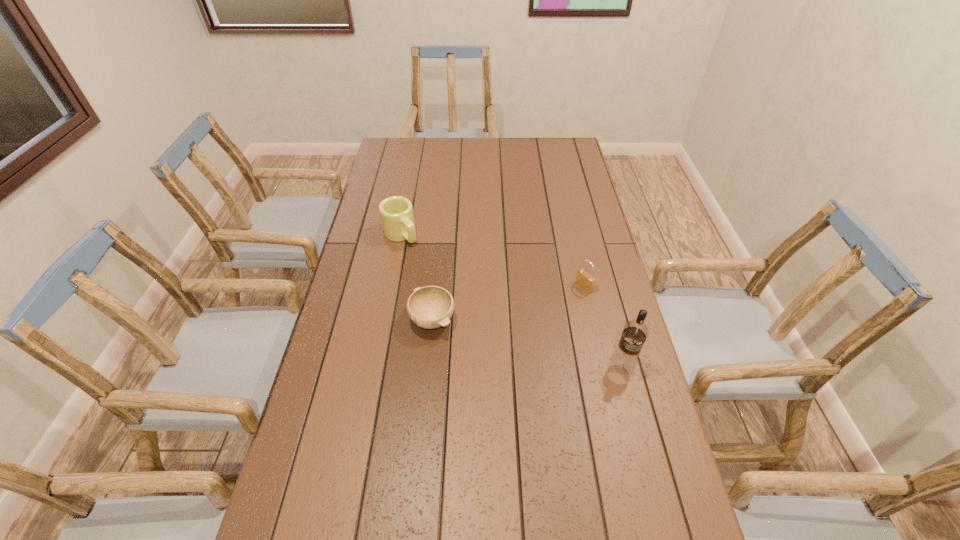
You are a GUI agent. You are given a task and a screenshot of the screen. Output one action in this format:
    pyautogui.click(x=<x>, y=<y>)
    Task: Click on the bowl
    
    Given the screenshot: What is the action you would take?
    pyautogui.click(x=430, y=307)

At what (x,y) coordinates should I click in order to perform the action: click on the shortest object. Please return your answer as a coordinate pair (x, y). This screenshot has width=960, height=540. Looking at the image, I should click on (430, 307).

Find the location of a particular element. the nearest object is located at coordinates (635, 332).

This screenshot has width=960, height=540. Find the location of `the rightmost object`. the rightmost object is located at coordinates (635, 332).

Find the location of `the farthest object`. the farthest object is located at coordinates (396, 213).

Where is `mug`? The image size is (960, 540). mug is located at coordinates (396, 213).

Where is `padlock`? padlock is located at coordinates (586, 281).

Where is `the third object from left to right`? The width and height of the screenshot is (960, 540). the third object from left to right is located at coordinates (586, 281).

Where is `free region located on the front of the second nearest object`? The image size is (960, 540). free region located on the front of the second nearest object is located at coordinates (419, 468).

The width and height of the screenshot is (960, 540). Identify the location of free space located 0.160m on the label of the tallest object. (x=640, y=430).